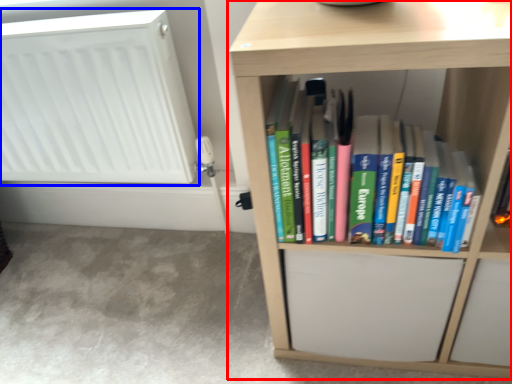
Question: Which of the following is the farthest to the observer, shelf (highlighted by a red box) or radiator (highlighted by a blue box)?

Choices:
 (A) shelf
 (B) radiator

Answer: (B)